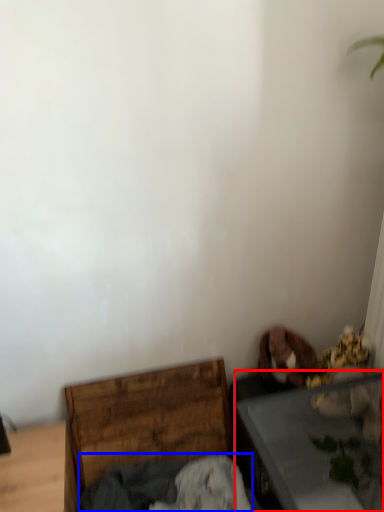
Question: Which point is further to the camera, table (highlighted by a red box) or clothing (highlighted by a blue box)?

Choices:
 (A) table
 (B) clothing

Answer: (B)